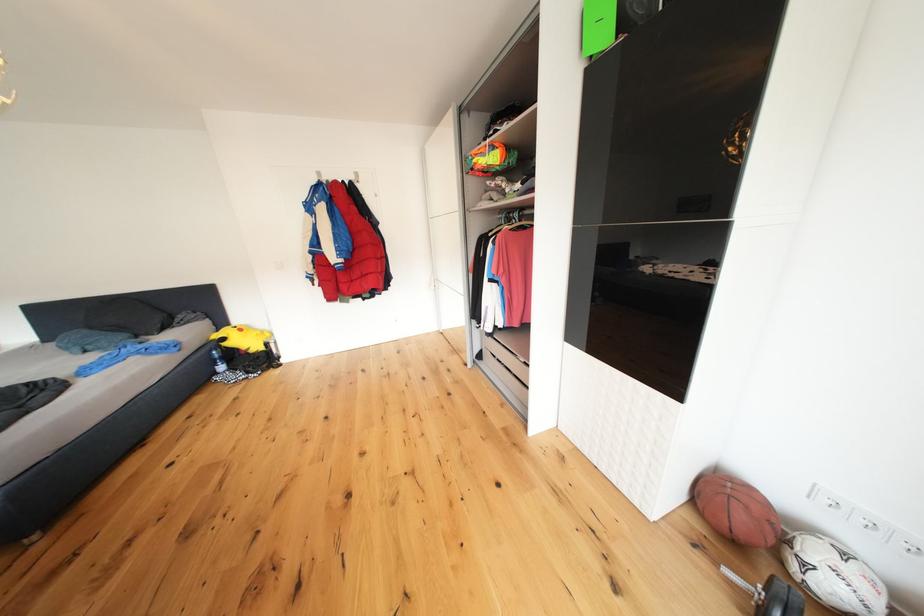
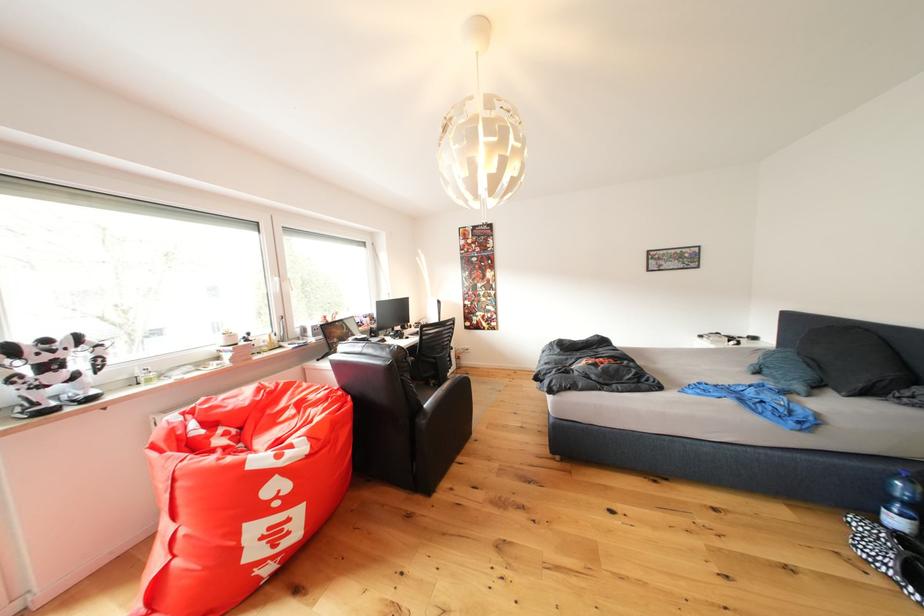
Where in the second image is the point corresponding to [225,383] from the first image?

(864, 527)